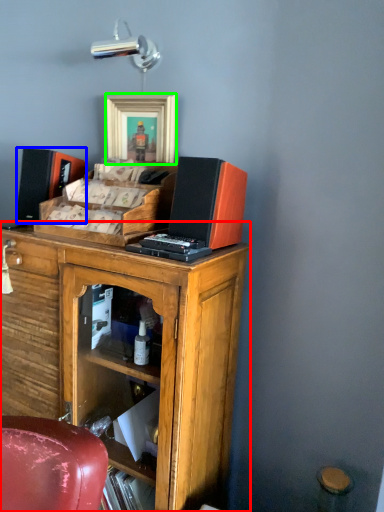
Question: Which object is the farthest from cabinetry (highlighted by a red box)? Choose among these: speaker (highlighted by a blue box) or picture frame (highlighted by a green box).

Choices:
 (A) speaker
 (B) picture frame

Answer: (B)